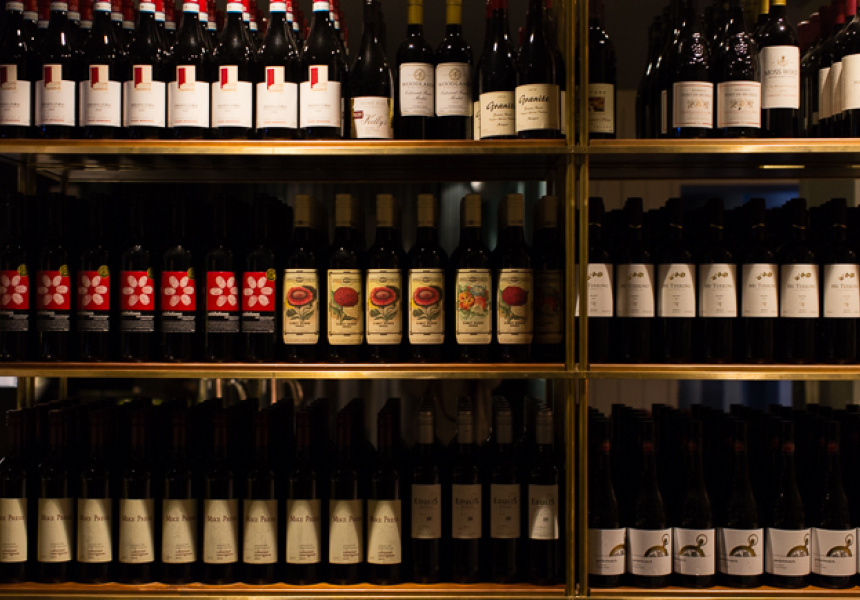
Locate an element on the screen. shelves is located at coordinates (260, 372), (286, 145), (255, 595), (756, 594), (734, 372), (736, 148).